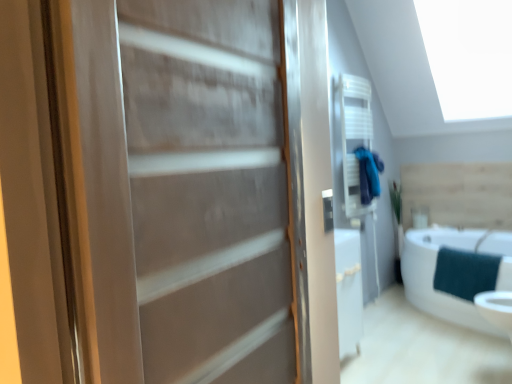
What do you see at coordinates (368, 174) in the screenshot? I see `teal fabric bathrobe at upper right` at bounding box center [368, 174].

In order to face white glossy bathtub at lower right, should I rotate leftwards or rightwards?

Turn right by 24.253 degrees to look at white glossy bathtub at lower right.

At what (x,y) coordinates should I click in order to perform the action: click on matte wood door at center. Please return your answer as a coordinate pair (x, y). This screenshot has height=384, width=512. Looking at the image, I should click on (188, 192).

Are teal fabric bathrobe at upper right and white glossy bathtub at lower right located far from each other?

teal fabric bathrobe at upper right is near white glossy bathtub at lower right, not far away.

Between teal fabric bathrobe at upper right and white glossy bathtub at lower right, which one has more height?

Standing taller between the two is white glossy bathtub at lower right.

Is point (379, 191) positioned after point (407, 278)?

That is False.

From a real-world perspective, is teal fabric bathrobe at upper right positioned under white glossy bathtub at lower right based on gravity?

No, from a real-world perspective, teal fabric bathrobe at upper right is not beneath white glossy bathtub at lower right.

Is white glossy bathtub at lower right far away from teal fabric bathrobe at upper right?

No, white glossy bathtub at lower right is not far away from teal fabric bathrobe at upper right.

Is white glossy bathtub at lower right further to camera compared to teal fabric bathrobe at upper right?

No, it is not.

From the image's perspective, who appears lower, white glossy bathtub at lower right or teal fabric bathrobe at upper right?

white glossy bathtub at lower right.

Is teal fabric bathrobe at upper right a part of white glossy bathtub at lower right?

No, teal fabric bathrobe at upper right is not surrounded by white glossy bathtub at lower right.

Is teal fabric towel at lower right in front of teal fabric bathrobe at upper right?

Yes, teal fabric towel at lower right is in front of teal fabric bathrobe at upper right.

Find the location of a particular element. blanket below the teal fabric bathrobe at upper right (from a real-world perspective) is located at coordinates (465, 273).

Measure the distance from teal fabric towel at lower right to teal fabric bathrobe at upper right.

The distance of teal fabric towel at lower right from teal fabric bathrobe at upper right is 35.20 inches.

In the image, there is a teal fabric towel at lower right. Where is `bathtub below it (from the image's perspective)`? This screenshot has width=512, height=384. bathtub below it (from the image's perspective) is located at coordinates (434, 273).

Considering the points (422, 294) and (466, 293), which point is in front, point (422, 294) or point (466, 293)?

Positioned in front is point (466, 293).

Is white glossy bathtub at lower right positioned with its back to teal fabric towel at lower right?

No, white glossy bathtub at lower right's orientation is not away from teal fabric towel at lower right.

In the scene shown: How many degrees apart are the facing directions of matte wood door at center and white glossy bathtub at lower right?

The angular difference between matte wood door at center and white glossy bathtub at lower right is 91.8 degrees.

Is point (244, 254) closer to camera compared to point (475, 240)?

That is True.

Considering the relative sizes of matte wood door at center and white glossy bathtub at lower right in the image provided, is matte wood door at center taller than white glossy bathtub at lower right?

Yes, matte wood door at center is taller than white glossy bathtub at lower right.

From the image's perspective, is matte wood door at center positioned above or below white glossy bathtub at lower right?

matte wood door at center is above white glossy bathtub at lower right.

Is matte wood door at center oriented towards teal fabric towel at lower right?

No.

Consider the image. Is matte wood door at center outside of teal fabric towel at lower right?

Yes, matte wood door at center is outside of teal fabric towel at lower right.

Can you confirm if matte wood door at center is smaller than teal fabric towel at lower right?

No.

From the image's perspective, between matte wood door at center and teal fabric towel at lower right, who is located below?

teal fabric towel at lower right appears lower in the image.

How far apart are white glossy bathtub at lower right and matte wood door at center?

white glossy bathtub at lower right and matte wood door at center are 2.57 meters apart.

Is white glossy bathtub at lower right wider or thinner than matte wood door at center?

Clearly, white glossy bathtub at lower right has more width compared to matte wood door at center.

Between white glossy bathtub at lower right and matte wood door at center, which one has more height?

matte wood door at center is taller.

Can you confirm if white glossy bathtub at lower right is smaller than matte wood door at center?

Incorrect, white glossy bathtub at lower right is not smaller in size than matte wood door at center.

Find the location of a particular element. The width and height of the screenshot is (512, 384). bathrobe lying on the left of white glossy bathtub at lower right is located at coordinates (368, 174).

Identify the location of bathrobe above the white glossy bathtub at lower right (from a real-world perspective). (368, 174).

When comparing their distances from teal fabric bathrobe at upper right, does white glossy bathtub at lower right or teal fabric towel at lower right seem further?

teal fabric towel at lower right is positioned further to the anchor teal fabric bathrobe at upper right.

Based on the photo, which object lies nearer to the anchor point teal fabric bathrobe at upper right, matte wood door at center or white glossy bathtub at lower right?

white glossy bathtub at lower right lies closer to teal fabric bathrobe at upper right than the other object.

Considering their positions, is teal fabric towel at lower right positioned closer to white glossy bathtub at lower right than matte wood door at center?

Among the two, teal fabric towel at lower right is located nearer to white glossy bathtub at lower right.

In the scene shown: Estimate the real-world distances between objects in this image. Which object is further from matte wood door at center, white glossy bathtub at lower right or teal fabric towel at lower right?

Based on the image, teal fabric towel at lower right appears to be further to matte wood door at center.

When comparing their distances from white glossy bathtub at lower right, does teal fabric bathrobe at upper right or teal fabric towel at lower right seem closer?

teal fabric towel at lower right is positioned closer to the anchor white glossy bathtub at lower right.

Based on their spatial positions, is teal fabric bathrobe at upper right or teal fabric towel at lower right further from matte wood door at center?

The object further to matte wood door at center is teal fabric towel at lower right.

Estimate the real-world distances between objects in this image. Which object is further from matte wood door at center, white glossy bathtub at lower right or teal fabric bathrobe at upper right?

Among the two, teal fabric bathrobe at upper right is located further to matte wood door at center.

When comparing their distances from white glossy bathtub at lower right, does teal fabric towel at lower right or teal fabric bathrobe at upper right seem closer?

Among the two, teal fabric towel at lower right is located nearer to white glossy bathtub at lower right.

You are a GUI agent. You are given a task and a screenshot of the screen. Output one action in this format:
    pyautogui.click(x=<x>, y=<y>)
    Task: Click on the blanket between matte wood door at center and teal fabric bathrobe at upper right in the front-back direction
    The height and width of the screenshot is (384, 512).
    Given the screenshot: What is the action you would take?
    pyautogui.click(x=465, y=273)

Find the location of `blanket between teal fabric bathrobe at upper right and white glossy bathtub at lower right from top to bottom`. blanket between teal fabric bathrobe at upper right and white glossy bathtub at lower right from top to bottom is located at coordinates (465, 273).

Locate an element on the screen. The height and width of the screenshot is (384, 512). bathtub located between matte wood door at center and teal fabric bathrobe at upper right in the depth direction is located at coordinates [x=434, y=273].

The width and height of the screenshot is (512, 384). I want to click on bathtub between matte wood door at center and teal fabric towel at lower right along the z-axis, so click(434, 273).